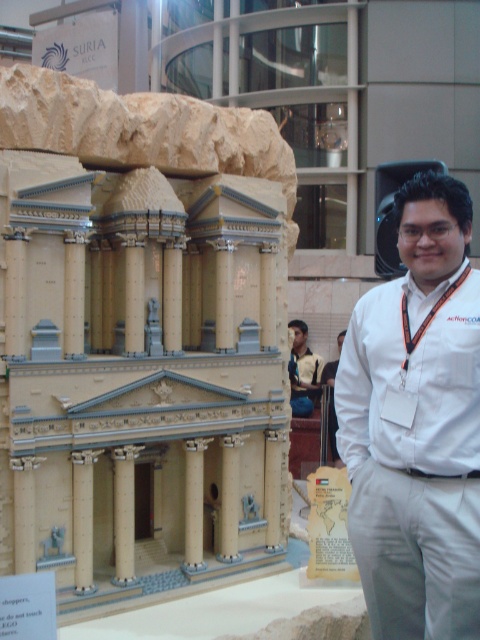
Is beige concrete column at center further to camera compared to beige stone column at center?

No, it is not.

Does beige concrete column at center have a greater width compared to beige stone column at center?

No.

Identify the location of beige concrete column at center. This screenshot has height=640, width=480. (83, 518).

Is beige concrete column at center closer to camera compared to light brown leather jacket at lower right?

Yes, it is.

This screenshot has height=640, width=480. What do you see at coordinates (83, 518) in the screenshot?
I see `beige concrete column at center` at bounding box center [83, 518].

Which is behind, point (79, 497) or point (296, 372)?

Positioned behind is point (296, 372).

This screenshot has height=640, width=480. Find the location of `beige concrete column at center`. beige concrete column at center is located at coordinates (83, 518).

Is light brown leather jacket at lower right wider than white shirt at center?

In fact, light brown leather jacket at lower right might be narrower than white shirt at center.

What do you see at coordinates (302, 371) in the screenshot?
I see `light brown leather jacket at lower right` at bounding box center [302, 371].

Image resolution: width=480 pixels, height=640 pixels. In order to click on light brown leather jacket at lower right in this screenshot , I will do `click(302, 371)`.